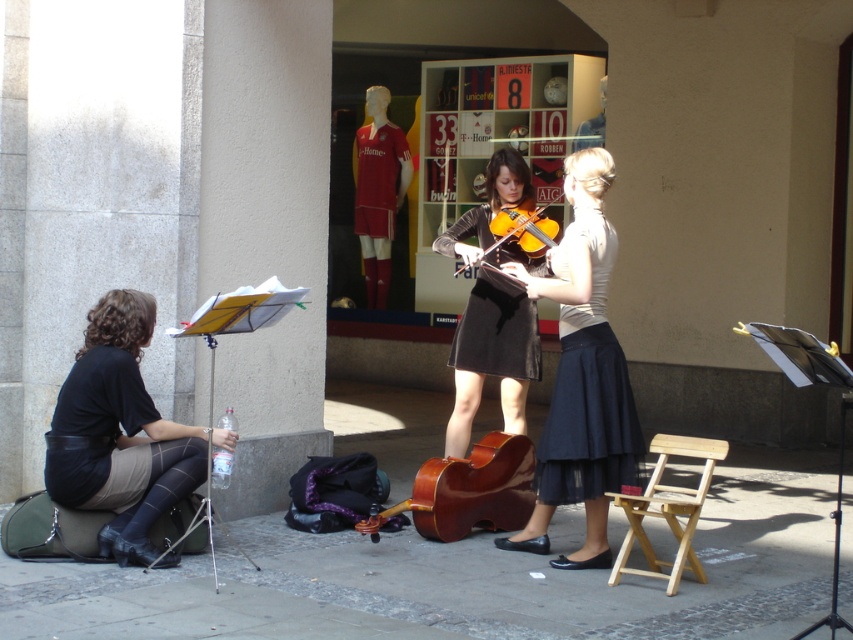
Question: Which object is positioned closest to the smooth concrete pavement at lower center?

Choices:
 (A) light wood folding chair at lower right
 (B) smooth leather jacket at upper center

Answer: (A)

Question: Which of the following is the farthest from the observer?

Choices:
 (A) (709, 474)
 (B) (469, 356)

Answer: (B)

Question: Which of the following is the farthest from the observer?

Choices:
 (A) smooth concrete pavement at lower center
 (B) smooth leather jacket at upper center
 (C) brown polished wood cello at center

Answer: (B)

Question: In this image, where is brown polished wood cello at center located relative to wooden violin at center?

Choices:
 (A) right
 (B) left

Answer: (B)

Question: Does black satin skirt at center come behind light wood folding chair at lower right?

Choices:
 (A) no
 (B) yes

Answer: (B)

Question: Can you confirm if smooth concrete pavement at lower center is positioned to the left of smooth leather jacket at upper center?

Choices:
 (A) no
 (B) yes

Answer: (B)